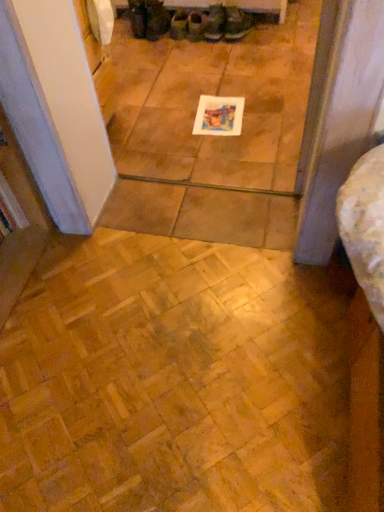
Where is `free point behind white paper at center`? The height and width of the screenshot is (512, 384). free point behind white paper at center is located at coordinates (218, 90).